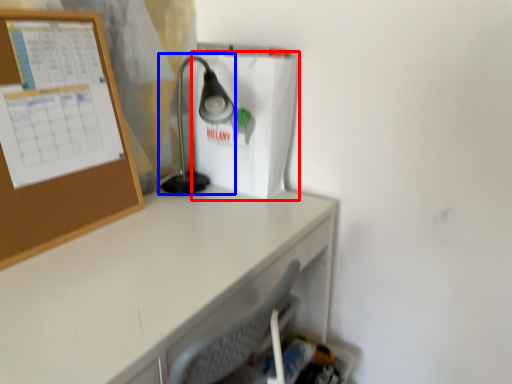
Question: Among these objects, which one is nearest to the camera, paper bag (highlighted by a red box) or lamp (highlighted by a blue box)?

Choices:
 (A) paper bag
 (B) lamp

Answer: (B)